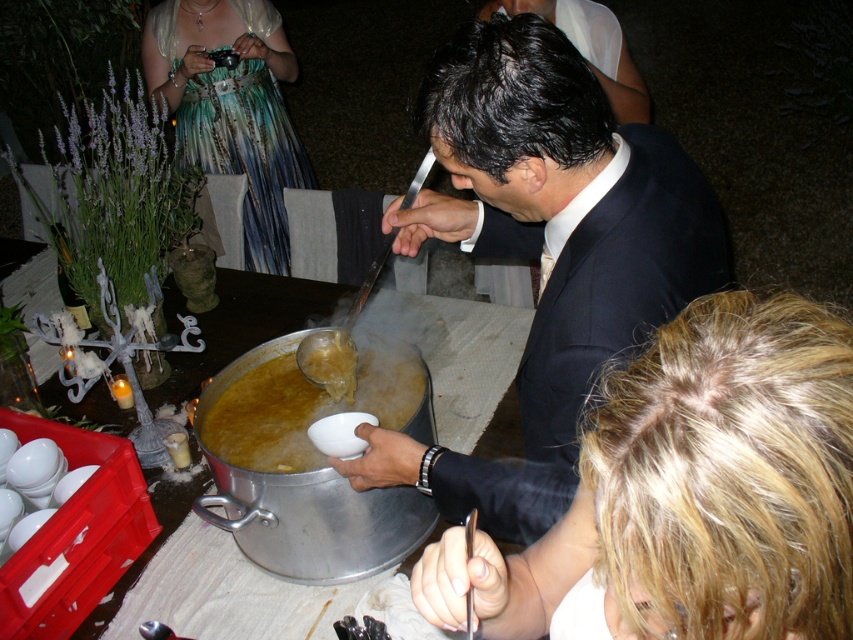
Question: Does shiny black suit at center lie behind shiny teal dress at upper left?

Choices:
 (A) yes
 (B) no

Answer: (B)

Question: Which object is closer to the camera taking this photo?

Choices:
 (A) metallic silver pot at center
 (B) blonde hair at lower right
 (C) golden brown broth at center
 (D) shiny teal dress at upper left

Answer: (B)

Question: Does blonde hair at lower right have a greater width compared to metallic silver pot at center?

Choices:
 (A) no
 (B) yes

Answer: (A)

Question: Which is nearer to the golden brown broth at center?

Choices:
 (A) shiny teal dress at upper left
 (B) blonde hair at lower right
 (C) shiny black suit at center
 (D) metallic silver pot at center

Answer: (C)

Question: Considering the real-world distances, which object is closest to the blonde hair at lower right?

Choices:
 (A) golden brown broth at center
 (B) metallic silver pot at center
 (C) shiny black suit at center
 (D) shiny teal dress at upper left

Answer: (C)

Question: Can you confirm if blonde hair at lower right is positioned below shiny teal dress at upper left?

Choices:
 (A) yes
 (B) no

Answer: (A)